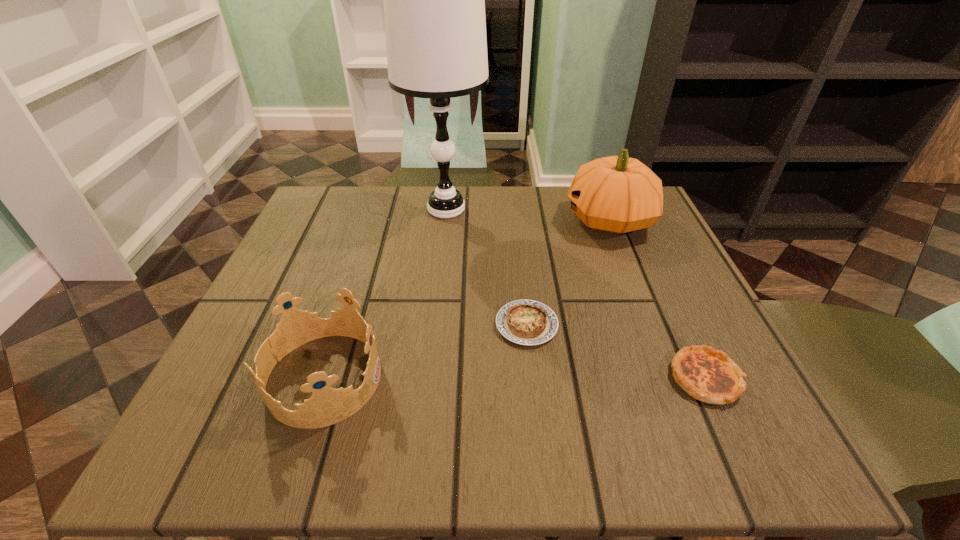
At what (x,y) coordinates should I click in order to perform the action: click on the tallest object. Please return your answer as a coordinate pair (x, y). The height and width of the screenshot is (540, 960). Looking at the image, I should click on (434, 0).

At what (x,y) coordinates should I click in order to perform the action: click on gourd. Please return your answer as a coordinate pair (x, y). This screenshot has width=960, height=540. Looking at the image, I should click on (617, 194).

You are a GUI agent. You are given a task and a screenshot of the screen. Output one action in this format:
    pyautogui.click(x=<x>, y=<y>)
    Task: Click on the tiara
    
    Given the screenshot: What is the action you would take?
    pyautogui.click(x=327, y=406)

The width and height of the screenshot is (960, 540). In order to click on the nearer quiche in this screenshot , I will do pos(708,375).

Where is `the shortest object`? the shortest object is located at coordinates (527, 322).

Find the location of a particular element. Image resolution: width=960 pixels, height=540 pixels. the left quiche is located at coordinates (527, 322).

The width and height of the screenshot is (960, 540). What are the coordinates of `blank area located on the right of the table lamp` in the screenshot? It's located at (512, 209).

Locate an element on the screen. blank space located on the side of the second tallest object with the carved face is located at coordinates (538, 220).

Where is `vacant region located on the side of the second tallest object with the carved face`? This screenshot has height=540, width=960. vacant region located on the side of the second tallest object with the carved face is located at coordinates (542, 220).

I want to click on free space located on the side of the second tallest object with the carved face, so click(440, 220).